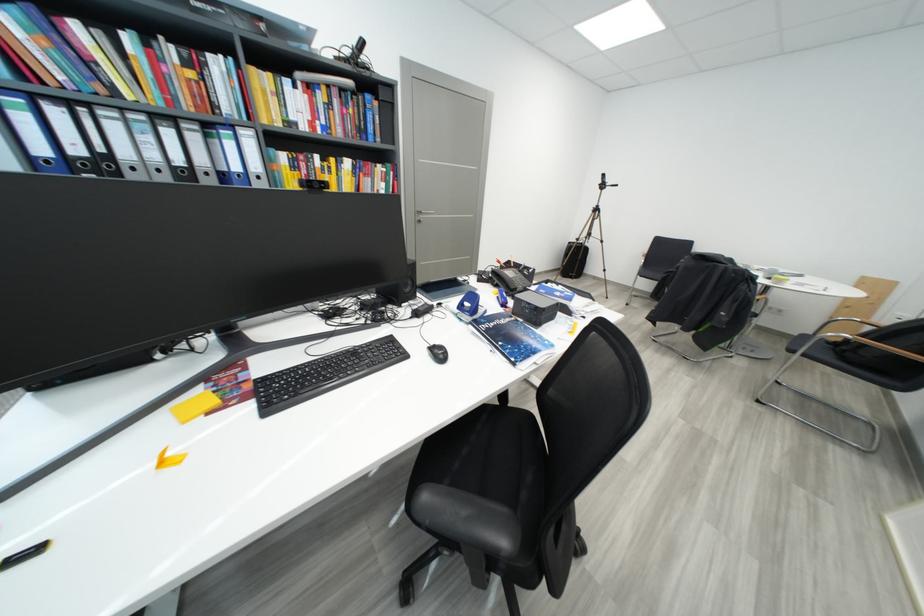
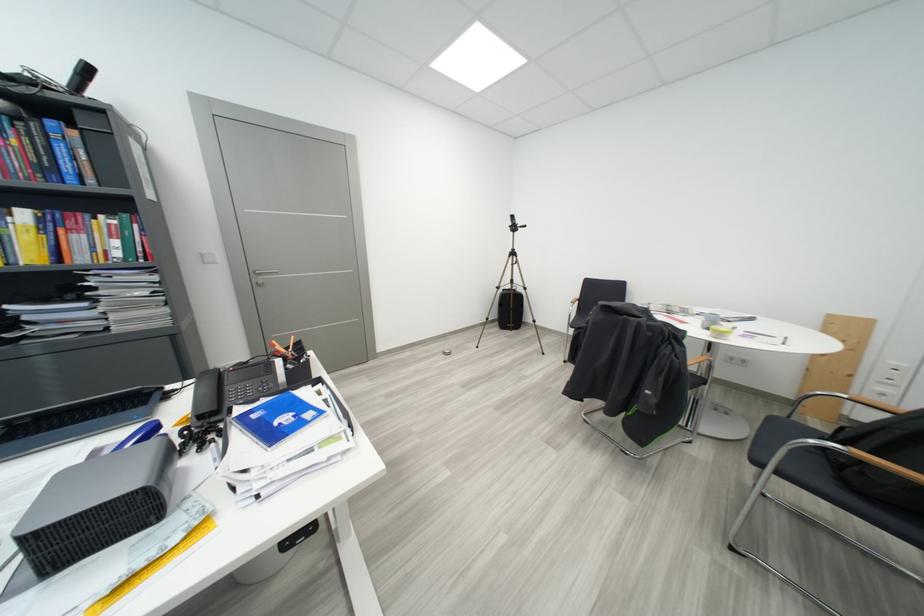
Locate, in the second image, the point that corresponds to (x=392, y=187) in the first image.

(126, 245)